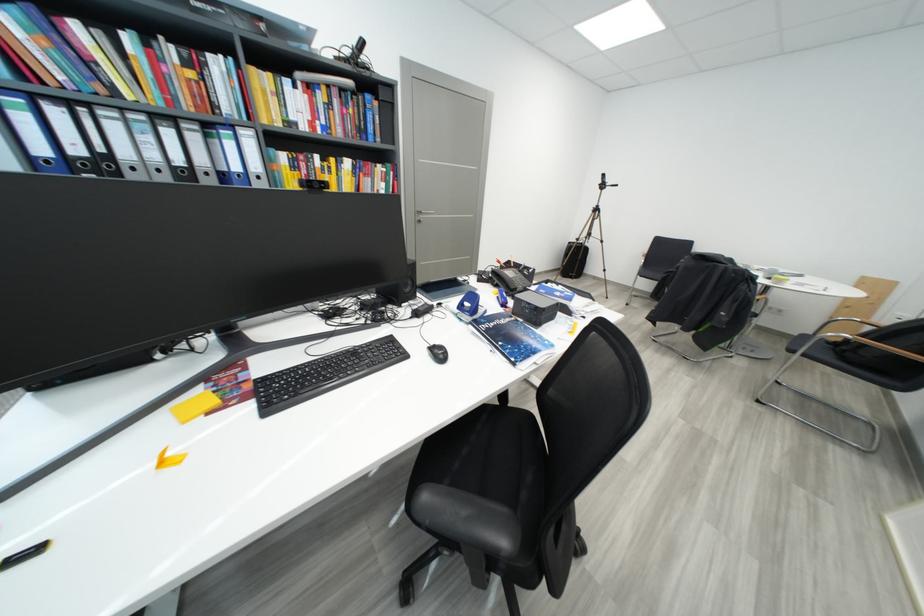
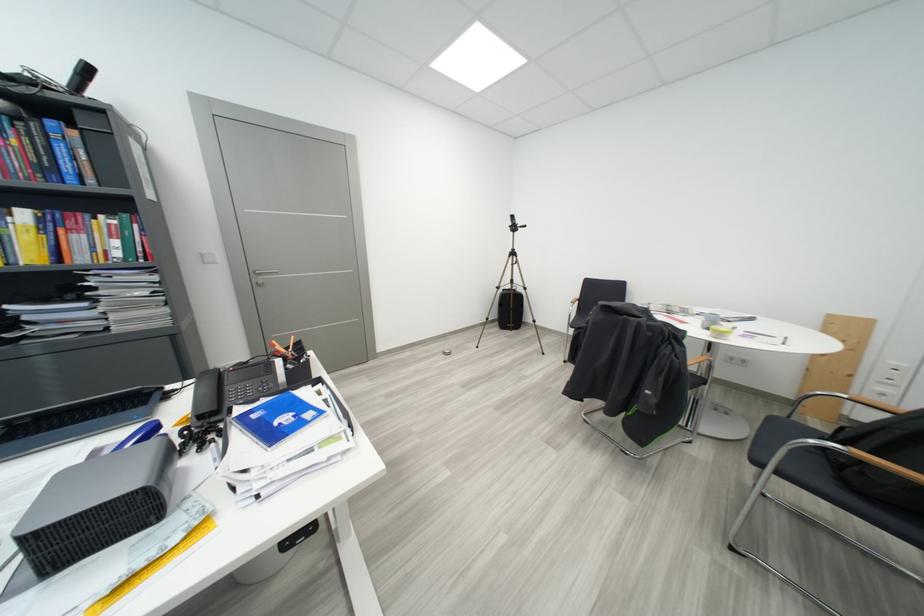
Locate, in the second image, the point that corresponds to (x=392, y=187) in the first image.

(126, 245)